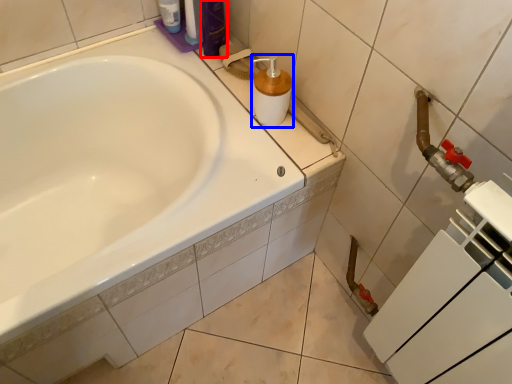
Question: Which object appears farthest to the camera in this image, toiletry (highlighted by a red box) or soap dispenser (highlighted by a blue box)?

Choices:
 (A) toiletry
 (B) soap dispenser

Answer: (A)